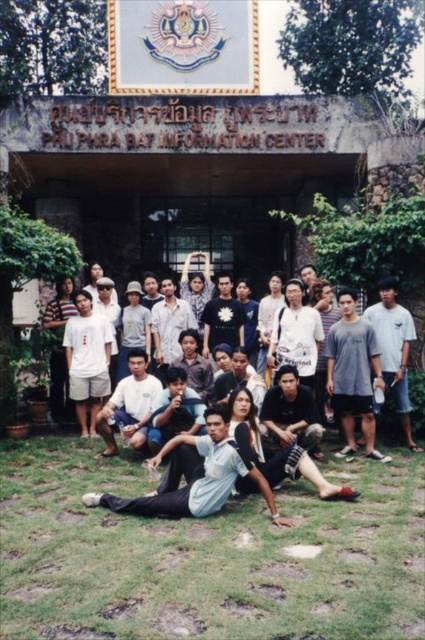
In the scene shown: You are standing in front of the PAIPHRABAT INFORMATION CENTER and want to place a small flag on the green grass at lower center. According to the image, where exactly should you place it?

The green grass at lower center is located at point (x=206, y=556), so you should place the flag there.

You are standing in front of the PAIPHRABAT INFORMATION CENTER and see the green grass at lower center and the light blue fabric shirt at center. Which object is closer to the ground?

The green grass at lower center is closer to the ground as it is positioned below the light blue fabric shirt at center.

You are a photographer trying to capture the entire group in a single shot. Considering the green grass at lower center and the light blue fabric shirt at center, which object occupies more horizontal space in the image?

The green grass at lower center occupies more horizontal space than the light blue fabric shirt at center because its width is larger.